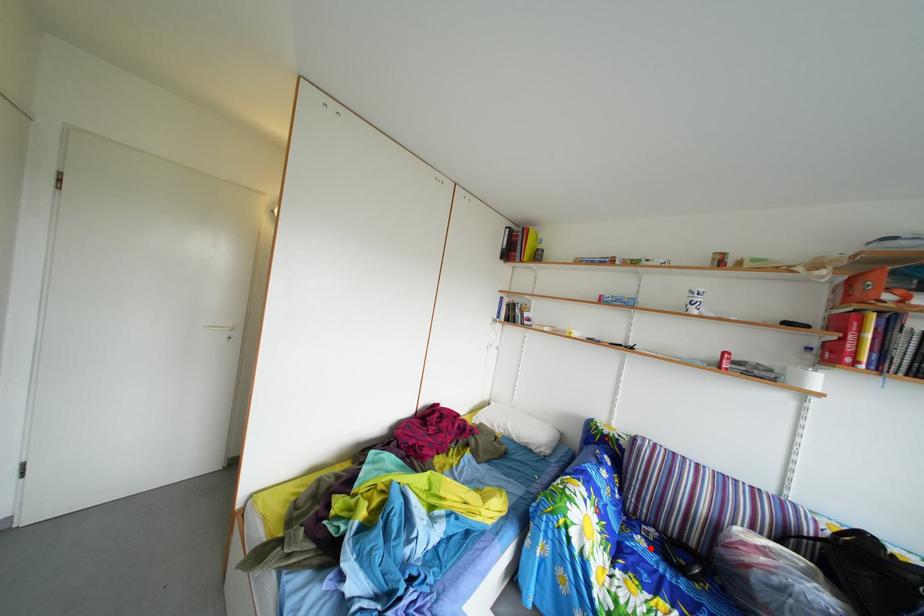
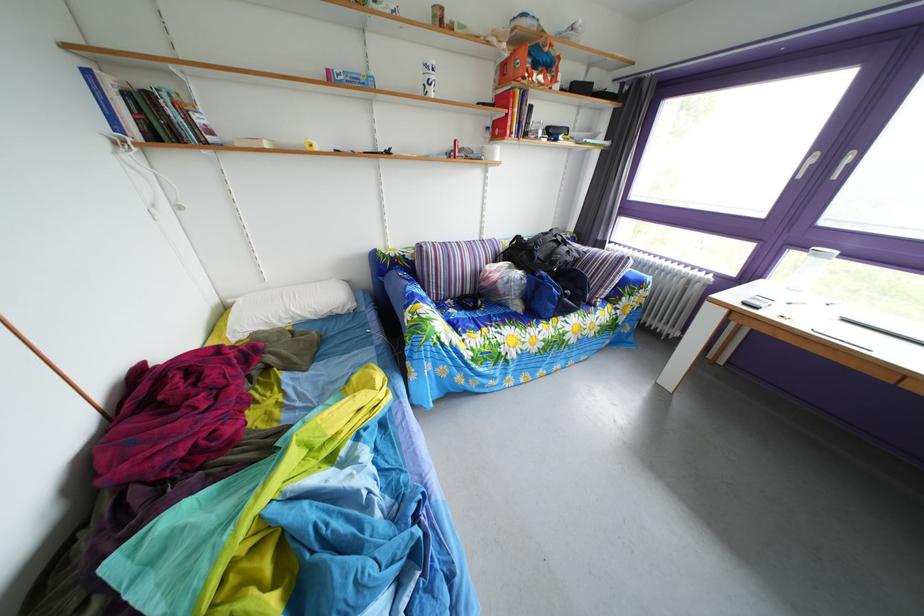
In the second image, find the point that corresponds to the highlighted location in the first image.

(463, 320)